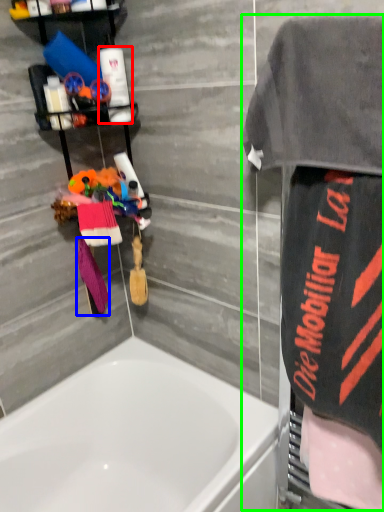
Question: Estimate the real-world distances between objects in this image. Which object is closer to toiletry (highlighted by a red box), beach towel (highlighted by a blue box) or bathrobe (highlighted by a green box)?

Choices:
 (A) beach towel
 (B) bathrobe

Answer: (A)